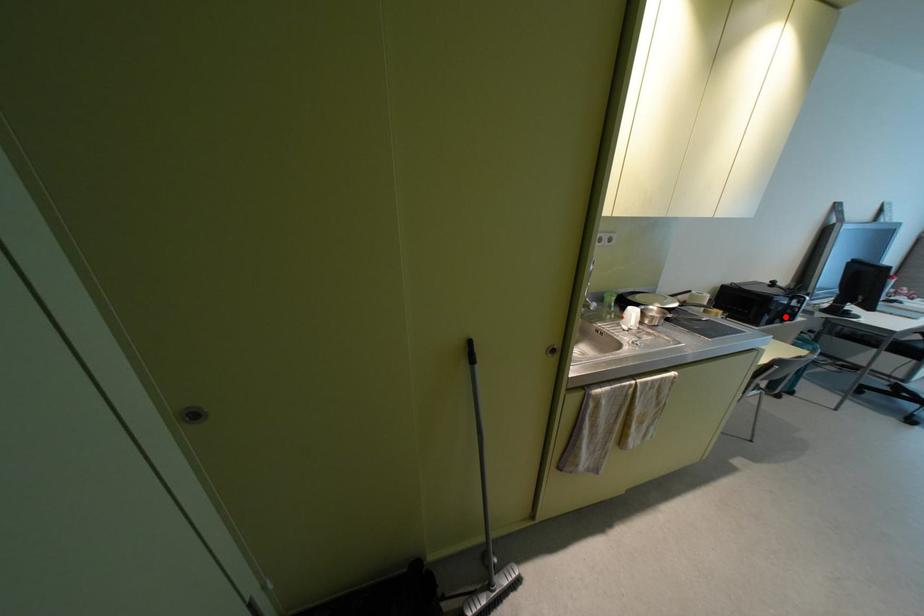
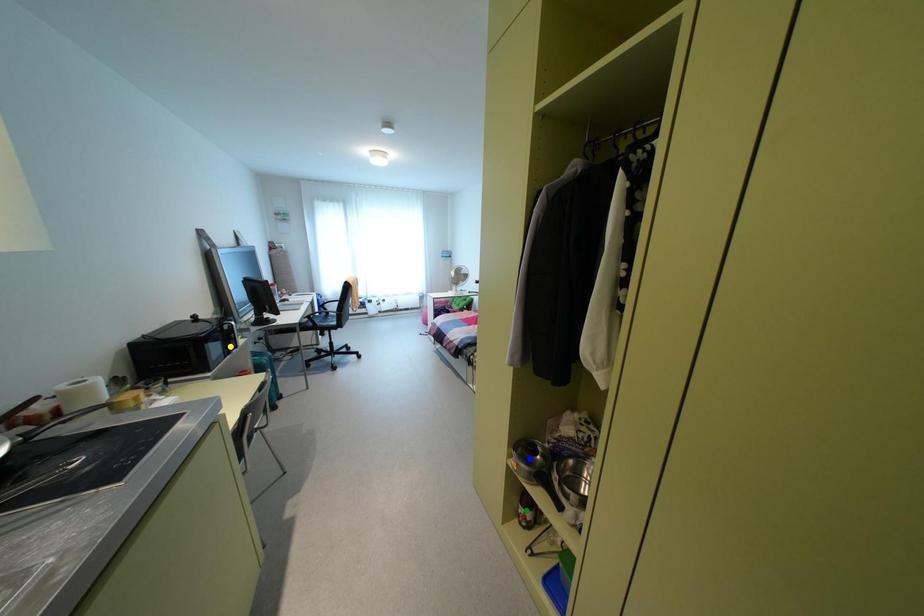
Question: I am providing you with two images of the same scene from different viewpoints. A red point is marked on the first image. You are given multiple points on the second image. Which point in image 2 is actually the same real-world point as the red point in image 1?

Choices:
 (A) blue point
 (B) yellow point
 (C) green point

Answer: (B)